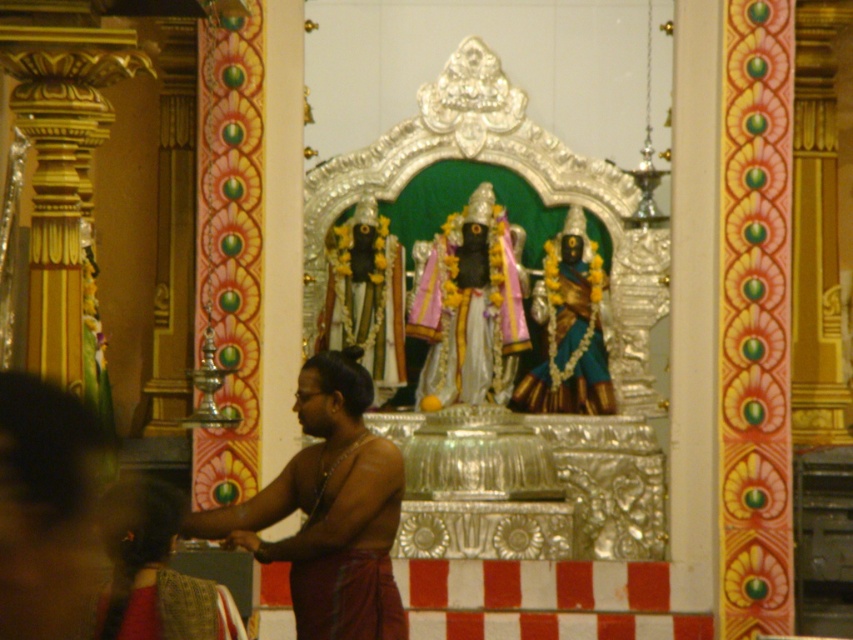
Question: Which of the following is the closest to the observer?

Choices:
 (A) polished silver statue at center
 (B) silky red sari at lower left
 (C) silky brown saree at lower left

Answer: (C)

Question: Can you confirm if polished silver statue at center is positioned above blue glossy statue at center?

Choices:
 (A) no
 (B) yes

Answer: (A)

Question: Which point is closer to the camera?

Choices:
 (A) (485, 221)
 (B) (550, 397)

Answer: (A)

Question: Which point is closer to the camera?

Choices:
 (A) blue glossy statue at center
 (B) brown silk monk at center

Answer: (B)

Question: Is brown silk monk at center bigger than blue glossy statue at center?

Choices:
 (A) yes
 (B) no

Answer: (A)

Question: Does brown silk monk at center come in front of silky red sari at lower left?

Choices:
 (A) yes
 (B) no

Answer: (B)